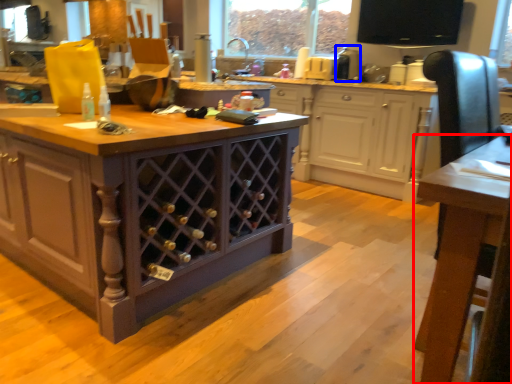
Question: Which point is further to the camera, table (highlighted by a red box) or appliance (highlighted by a blue box)?

Choices:
 (A) table
 (B) appliance

Answer: (B)